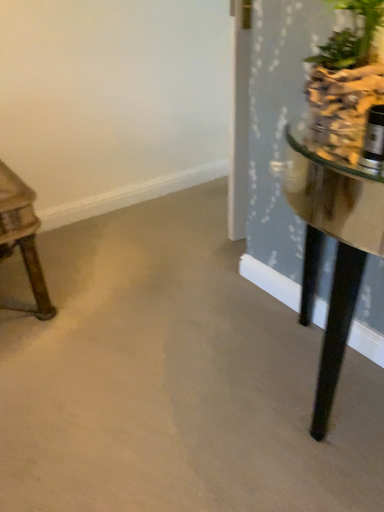
Question: From their relative heights in the image, would you say green leafy plant at upper right is taller or shorter than smooth concrete floor at center?

Choices:
 (A) tall
 (B) short

Answer: (B)

Question: Is point (317, 90) closer or farther from the camera than point (82, 428)?

Choices:
 (A) farther
 (B) closer

Answer: (B)

Question: Which of these objects is positioned closest to the smooth concrete floor at center?

Choices:
 (A) green leafy plant at upper right
 (B) wooden table at left

Answer: (B)

Question: Based on their relative distances, which object is farther from the smooth concrete floor at center?

Choices:
 (A) green leafy plant at upper right
 (B) wooden table at left

Answer: (A)